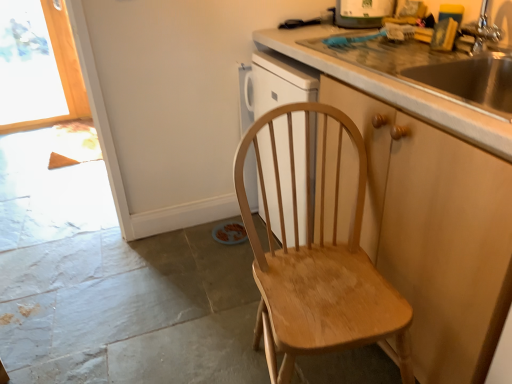
Question: Is white glossy dishwasher at upper center shorter than wooden cabinet at right?

Choices:
 (A) no
 (B) yes

Answer: (B)

Question: From a real-world perspective, is white glossy dishwasher at upper center positioned under wooden cabinet at right based on gravity?

Choices:
 (A) no
 (B) yes

Answer: (A)

Question: Is the depth of white glossy dishwasher at upper center less than that of wooden cabinet at right?

Choices:
 (A) no
 (B) yes

Answer: (A)

Question: Is white glossy dishwasher at upper center not close to wooden cabinet at right?

Choices:
 (A) no
 (B) yes

Answer: (B)

Question: Is white glossy dishwasher at upper center looking in the opposite direction of wooden cabinet at right?

Choices:
 (A) no
 (B) yes

Answer: (A)

Question: Is point (312, 297) positioned closer to the camera than point (385, 144)?

Choices:
 (A) closer
 (B) farther

Answer: (B)

Question: Is light brown wooden chair at center spatially inside wooden cabinet at right, or outside of it?

Choices:
 (A) outside
 (B) inside

Answer: (A)

Question: Looking at the image, does light brown wooden chair at center seem bigger or smaller compared to wooden cabinet at right?

Choices:
 (A) small
 (B) big

Answer: (A)

Question: Looking at their shapes, would you say light brown wooden chair at center is wider or thinner than wooden cabinet at right?

Choices:
 (A) thin
 (B) wide

Answer: (A)

Question: Is point (61, 87) positioned closer to the camera than point (361, 153)?

Choices:
 (A) closer
 (B) farther

Answer: (B)

Question: From the image's perspective, is transparent glass window at upper left positioned above or below light brown wooden chair at center?

Choices:
 (A) below
 (B) above

Answer: (B)

Question: In the image, is transparent glass window at upper left positioned in front of or behind light brown wooden chair at center?

Choices:
 (A) front
 (B) behind

Answer: (B)

Question: From a real-world perspective, is transparent glass window at upper left positioned above or below light brown wooden chair at center?

Choices:
 (A) below
 (B) above

Answer: (B)

Question: Based on their positions, is white glossy dishwasher at upper center located to the left or right of light brown wooden chair at center?

Choices:
 (A) right
 (B) left

Answer: (A)

Question: Looking at their shapes, would you say white glossy dishwasher at upper center is wider or thinner than light brown wooden chair at center?

Choices:
 (A) thin
 (B) wide

Answer: (A)